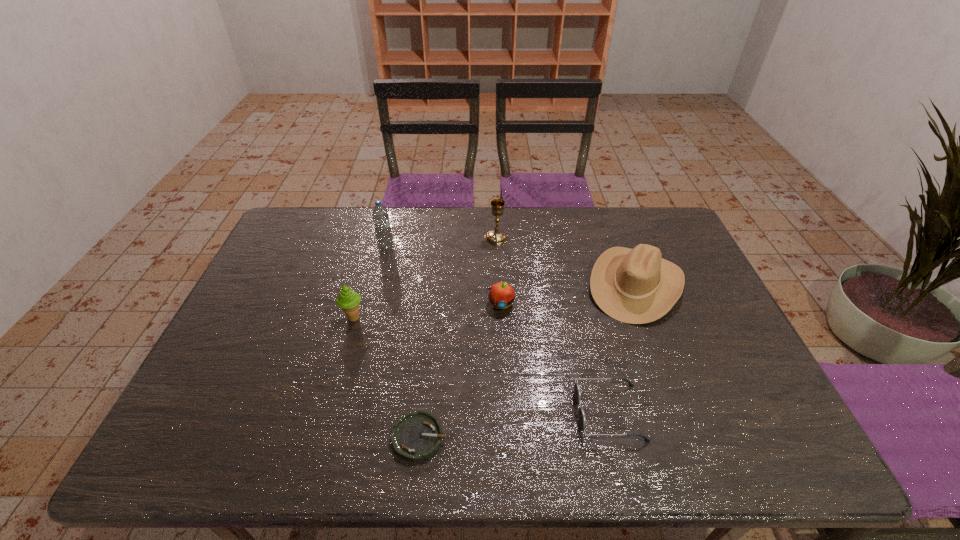
This screenshot has width=960, height=540. In order to click on free space that is in between the apple and the sunglasses in this screenshot , I will do coord(555,358).

The height and width of the screenshot is (540, 960). I want to click on vacant point located between the apple and the cowboy hat, so click(x=567, y=294).

The height and width of the screenshot is (540, 960). I want to click on free space between the fifth tallest object and the icecream, so click(427, 311).

Locate an element on the screen. vacant space that is in between the tallest object and the chalice is located at coordinates (442, 243).

Find the location of a particular element. empty space that is in between the tallest object and the cowboy hat is located at coordinates (511, 267).

In order to click on free spot between the cowboy hat and the third shortest object in this screenshot , I will do `click(567, 294)`.

Locate an element on the screen. This screenshot has width=960, height=540. empty space that is in between the icecream and the ashtray is located at coordinates (386, 377).

Identify which object is the closest to the cowboy hat. Please provide its 2D coordinates. Your answer should be formatted as a tuple, i.e. [(x, y)], where the tuple contains the x and y coordinates of a point satisfying the conditions above.

[(577, 393)]

Identify the location of object that can be found as the fourth closest to the chalice. The image size is (960, 540). (348, 300).

I want to click on vacant area in the image that satisfies the following two spatial constraints: 1. on the front side of the tallest object; 2. on the left side of the shortest object, so click(341, 437).